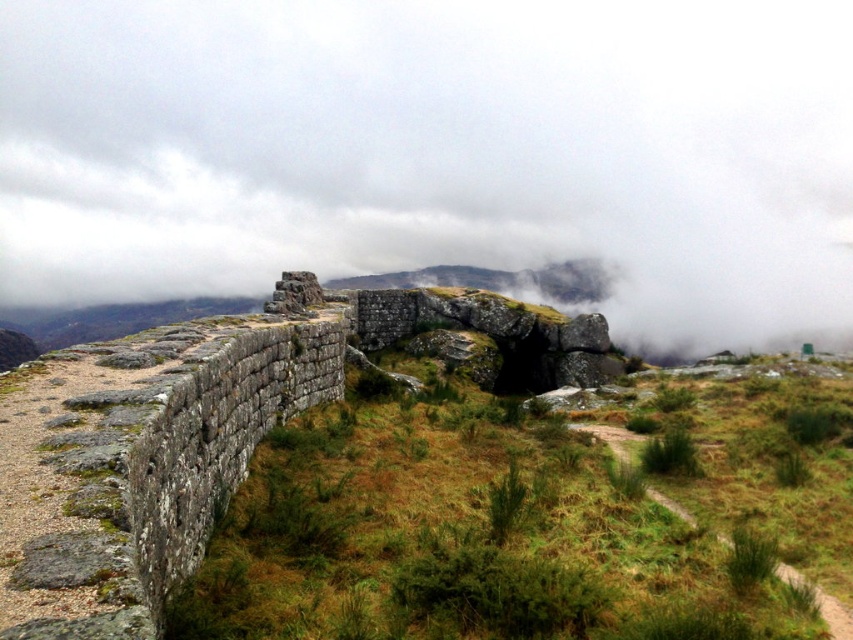
You are standing on the path in the scene and looking towards the green grassy at left. Which direction should you turn to see the white fluffy cloud at upper center?

You should turn to your right to see the white fluffy cloud at upper center because it is located to the left of the green grassy at left, meaning it is positioned to the viewer right when facing the green grassy at left.

You are an artist planning to paint the scene. You want to ensure the white fluffy cloud at upper center and the green grass at center are proportionally accurate. Which one should you make wider in your painting?

The white fluffy cloud at upper center should be made wider in the painting since its width is larger than the green grass at center.